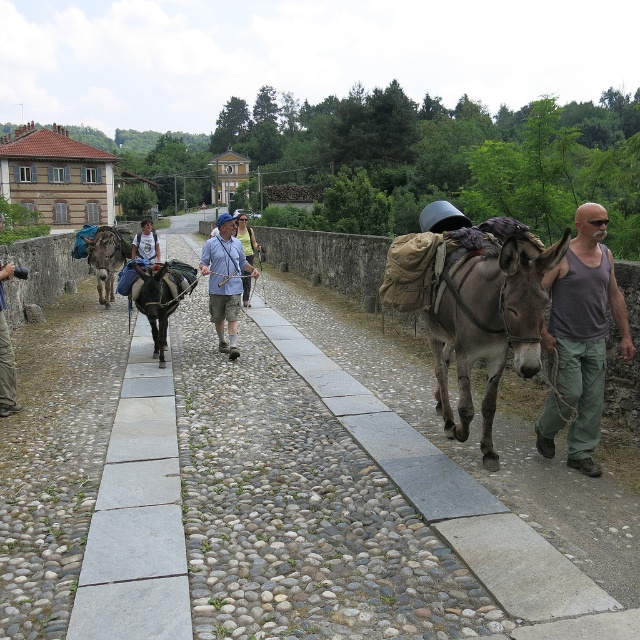
Is gray matte donkey at center shorter than dark brown leather mule at center?

In fact, gray matte donkey at center may be taller than dark brown leather mule at center.

Which is in front, point (502, 307) or point (176, 305)?

Point (502, 307)

Where is `gray matte donkey at center`? This screenshot has width=640, height=640. gray matte donkey at center is located at coordinates (490, 326).

Does gray matte donkey at center have a lesser height compared to brown leather mule at left?

Indeed, gray matte donkey at center has a lesser height compared to brown leather mule at left.

Locate an element on the screen. This screenshot has height=640, width=640. gray matte donkey at center is located at coordinates (490, 326).

Can you confirm if gray tank top at right is positioned above dark brown leather mule at center?

Incorrect, gray tank top at right is not positioned above dark brown leather mule at center.

Is gray tank top at right below dark brown leather mule at center?

Yes.

Is point (573, 372) positioned in front of point (154, 272)?

Yes, it is in front of point (154, 272).

Where is `gray tank top at right`? This screenshot has height=640, width=640. gray tank top at right is located at coordinates (580, 339).